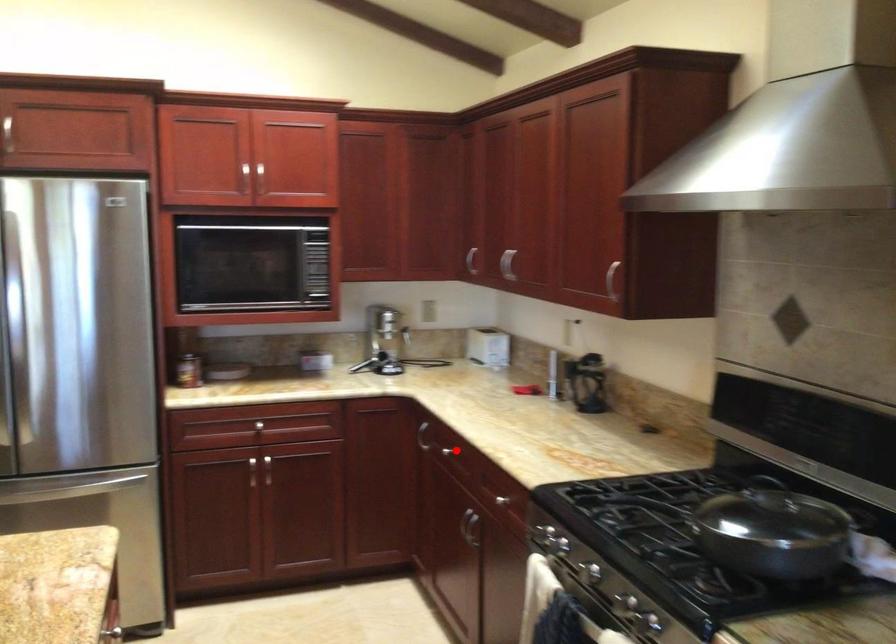
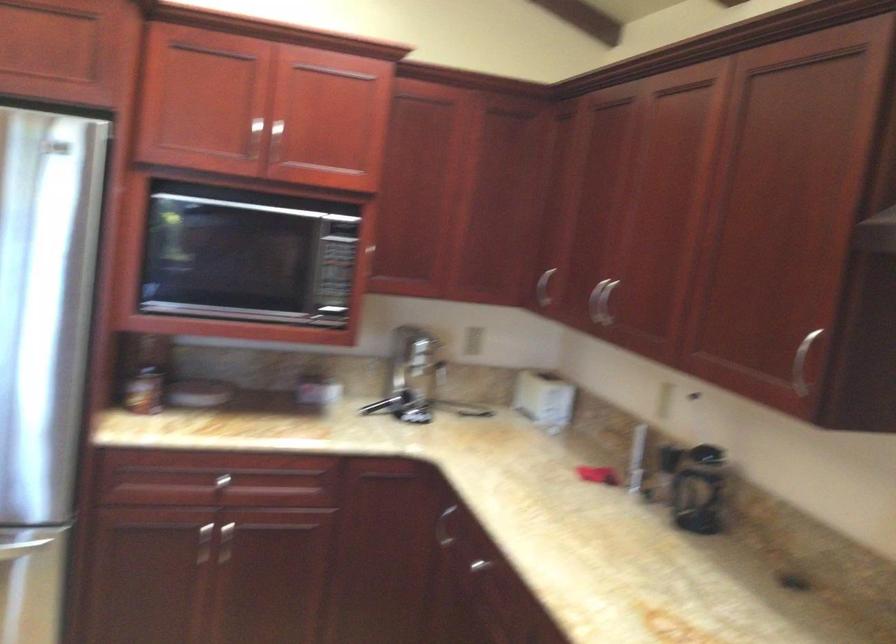
Question: I am providing you with two images of the same scene from different viewpoints. In image1, a red point is highlighted. Considering the same 3D point in image2, which of the following is correct?

Choices:
 (A) It is closer
 (B) It is farther

Answer: (A)